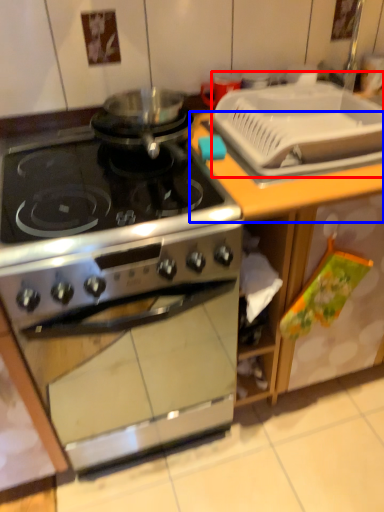
Question: Which point is closer to the camera, sink (highlighted by a red box) or counter top (highlighted by a blue box)?

Choices:
 (A) sink
 (B) counter top

Answer: (A)